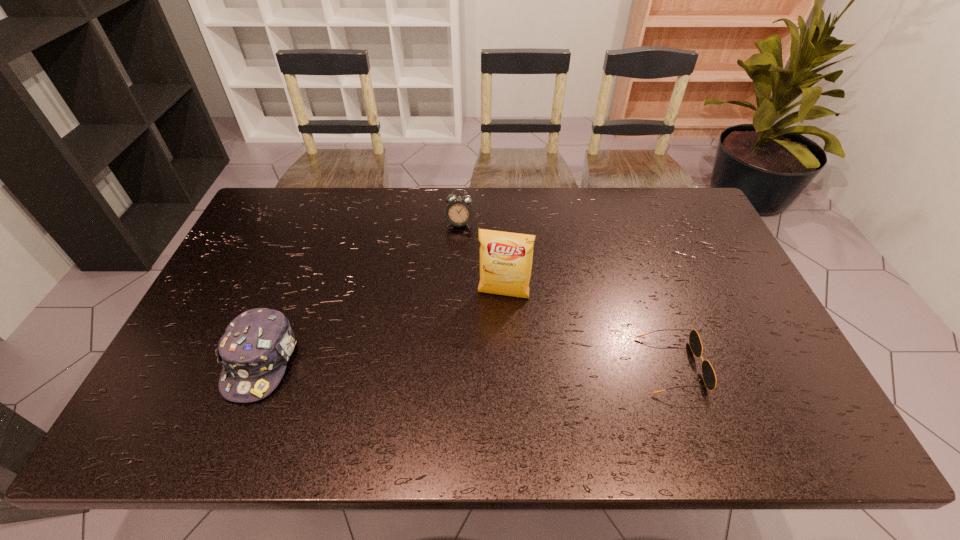
In order to click on headwear in this screenshot , I will do `click(254, 350)`.

The width and height of the screenshot is (960, 540). What are the coordinates of `sunglasses` in the screenshot? It's located at (708, 374).

The width and height of the screenshot is (960, 540). In order to click on the rightmost object in this screenshot , I will do `click(708, 374)`.

Where is `the farthest object`? The height and width of the screenshot is (540, 960). the farthest object is located at coordinates (458, 212).

Find the location of `the second object from left to right`. the second object from left to right is located at coordinates (458, 212).

Find the location of a particular element. The height and width of the screenshot is (540, 960). crisp (potato chip) is located at coordinates (505, 258).

At what (x,y) coordinates should I click in order to perform the action: click on the third object from left to right. Please return your answer as a coordinate pair (x, y). Looking at the image, I should click on (505, 258).

Find the location of a particular element. The height and width of the screenshot is (540, 960). vacant space located 0.080m on the front-facing side of the sunglasses is located at coordinates (732, 366).

Where is `vacant region located on the face of the third object from right to left`? This screenshot has width=960, height=540. vacant region located on the face of the third object from right to left is located at coordinates (454, 247).

Where is `vacant space situated on the face of the third object from right to left`? vacant space situated on the face of the third object from right to left is located at coordinates (449, 264).